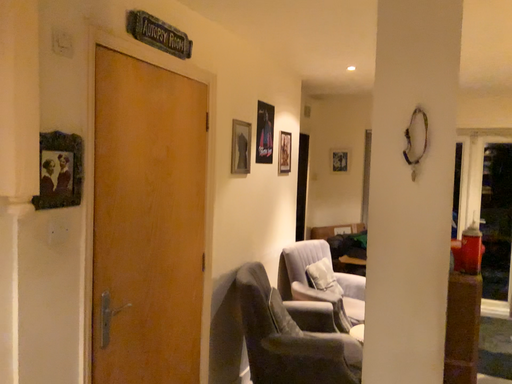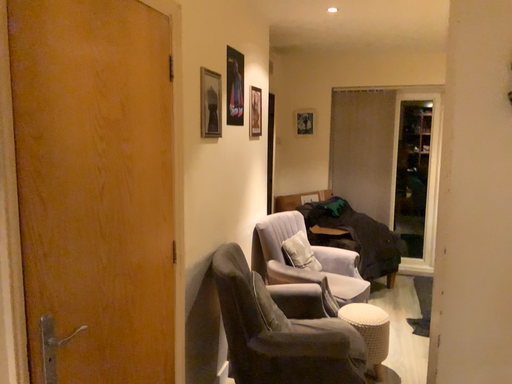
Question: How did the camera likely rotate when shooting the video?

Choices:
 (A) rotated right
 (B) rotated left

Answer: (A)